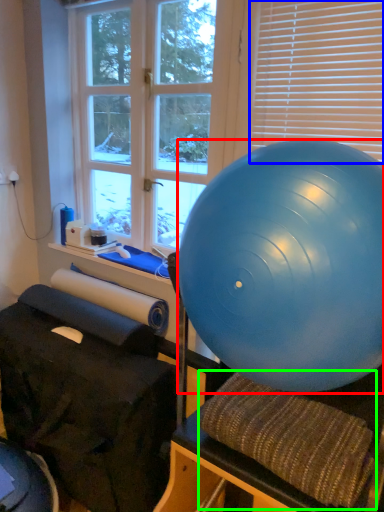
Question: Which object is positioned closest to ball (highlighted by a red box)? Select from blind (highlighted by a blue box) and bean bag chair (highlighted by a green box).

Choices:
 (A) blind
 (B) bean bag chair

Answer: (B)